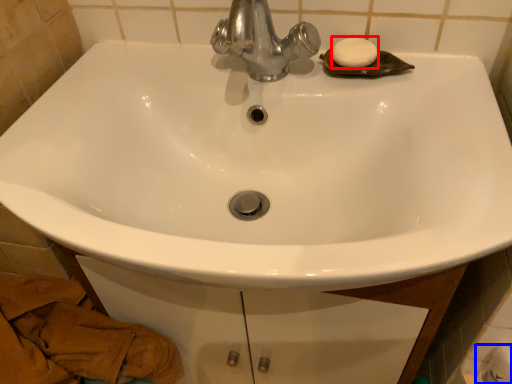
Question: Which object appears closest to the camera in this image, soap (highlighted by a red box) or toilet paper (highlighted by a blue box)?

Choices:
 (A) soap
 (B) toilet paper

Answer: (B)